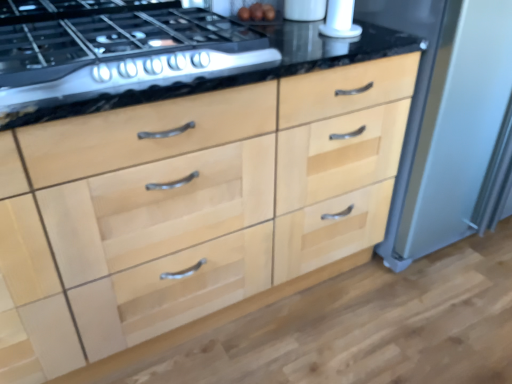
Question: From the image's perspective, is white glossy salt shaker at upper right, which is the second appliance from right to left, beneath satin silver refrigerator at right, which is the 1th appliance from right to left?

Choices:
 (A) yes
 (B) no

Answer: (B)

Question: Does white glossy salt shaker at upper right, which is the second appliance from right to left, have a greater width compared to satin silver refrigerator at right, which is the 1th appliance from right to left?

Choices:
 (A) yes
 (B) no

Answer: (B)

Question: Considering the relative sizes of white glossy salt shaker at upper right, the 1th appliance in the left-to-right sequence, and satin silver refrigerator at right, which is the 2th appliance in left-to-right order, in the image provided, is white glossy salt shaker at upper right, the 1th appliance in the left-to-right sequence, thinner than satin silver refrigerator at right, which is the 2th appliance in left-to-right order,?

Choices:
 (A) yes
 (B) no

Answer: (A)

Question: Does white glossy salt shaker at upper right, the 1th appliance in the left-to-right sequence, appear on the left side of satin silver refrigerator at right, which is the 1th appliance from right to left?

Choices:
 (A) no
 (B) yes

Answer: (B)

Question: Is white glossy salt shaker at upper right, the 1th appliance in the left-to-right sequence, behind satin silver refrigerator at right, which is the 1th appliance from right to left?

Choices:
 (A) yes
 (B) no

Answer: (A)

Question: Does white glossy salt shaker at upper right, which is the second appliance from right to left, have a larger size compared to satin silver refrigerator at right, which is the 2th appliance in left-to-right order?

Choices:
 (A) no
 (B) yes

Answer: (A)

Question: From the image's perspective, is satin black gas stove at upper left beneath natural wood drawers at center?

Choices:
 (A) yes
 (B) no

Answer: (B)

Question: Considering the relative sizes of satin black gas stove at upper left and natural wood drawers at center in the image provided, is satin black gas stove at upper left bigger than natural wood drawers at center?

Choices:
 (A) yes
 (B) no

Answer: (B)

Question: Is satin black gas stove at upper left outside natural wood drawers at center?

Choices:
 (A) yes
 (B) no

Answer: (A)

Question: From a real-world perspective, is satin black gas stove at upper left on natural wood drawers at center?

Choices:
 (A) yes
 (B) no

Answer: (A)

Question: Is satin black gas stove at upper left touching natural wood drawers at center?

Choices:
 (A) no
 (B) yes

Answer: (A)

Question: Is natural wood drawers at center a part of satin black gas stove at upper left?

Choices:
 (A) no
 (B) yes

Answer: (A)

Question: Is satin black gas stove at upper left closer to the viewer compared to white glossy salt shaker at upper right, which is the second appliance from right to left?

Choices:
 (A) yes
 (B) no

Answer: (A)